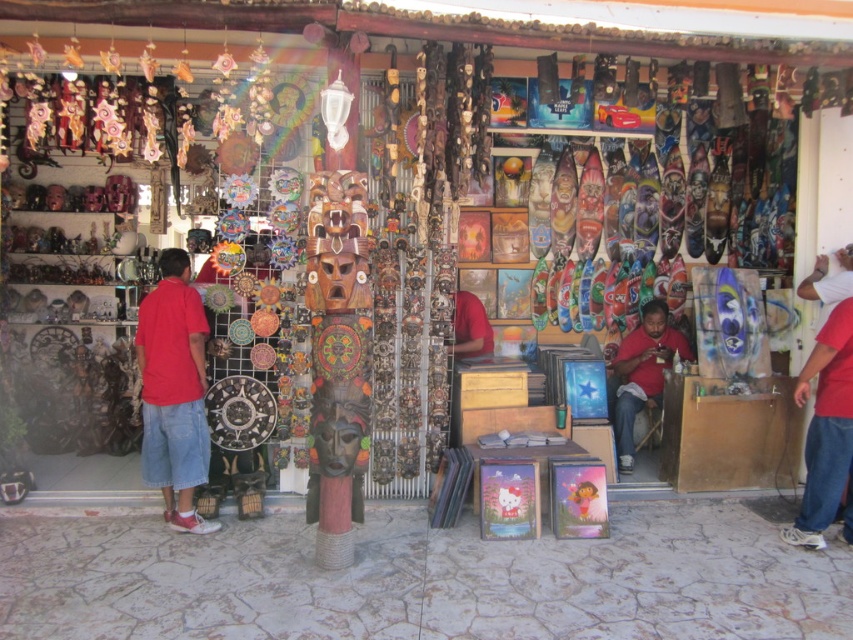
You are a customer at the outdoor market stall and want to purchase the red cotton shirt at left. Where should you go to find it?

The red cotton shirt at left is located at point (173,392), so you should go to that coordinate to find it.

You are standing at a distance of 5 meters from the market stall. A point of interest is located at coordinates point (148, 451). Can you reach this point without moving closer than 4.92 meters to the stall?

The distance of point (148, 451) from viewer is 4.92 meters. Since you are already at 5 meters away, you can reach the point without moving closer than 4.92 meters as you are slightly farther away.

You are a customer at the market stall and want to buy the red cotton shirt at left and the matte red shirt at center. When looking at the shirts from the front of the stall, which shirt do you see first?

The red cotton shirt at left is in front of the matte red shirt at center, so you will see the red cotton shirt at left first when looking from the front of the stall.